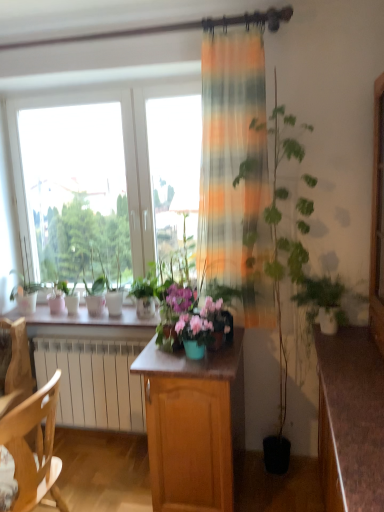
Question: Is brown wood desk at lower right to the left of wooden cabinet at center from the viewer's perspective?

Choices:
 (A) yes
 (B) no

Answer: (B)

Question: Is brown wood desk at lower right facing away from wooden cabinet at center?

Choices:
 (A) yes
 (B) no

Answer: (B)

Question: Is wooden cabinet at center surrounded by brown wood desk at lower right?

Choices:
 (A) yes
 (B) no

Answer: (B)

Question: Is brown wood desk at lower right wider than wooden cabinet at center?

Choices:
 (A) yes
 (B) no

Answer: (B)

Question: Is brown wood desk at lower right positioned beyond the bounds of wooden cabinet at center?

Choices:
 (A) yes
 (B) no

Answer: (A)

Question: Does brown wood desk at lower right lie behind wooden cabinet at center?

Choices:
 (A) no
 (B) yes

Answer: (A)

Question: Are brown wood desk at lower right and white glossy window sill at center located far from each other?

Choices:
 (A) no
 (B) yes

Answer: (B)

Question: Is brown wood desk at lower right at the left side of white glossy window sill at center?

Choices:
 (A) no
 (B) yes

Answer: (A)

Question: Is brown wood desk at lower right oriented towards white glossy window sill at center?

Choices:
 (A) yes
 (B) no

Answer: (A)

Question: Would you say brown wood desk at lower right contains white glossy window sill at center?

Choices:
 (A) no
 (B) yes

Answer: (A)

Question: From a real-world perspective, is brown wood desk at lower right over white glossy window sill at center?

Choices:
 (A) yes
 (B) no

Answer: (B)

Question: From a real-world perspective, does brown wood desk at lower right sit lower than white glossy window sill at center?

Choices:
 (A) no
 (B) yes

Answer: (B)

Question: Is green matte plant at right at the back of brown wood desk at lower right?

Choices:
 (A) no
 (B) yes

Answer: (A)